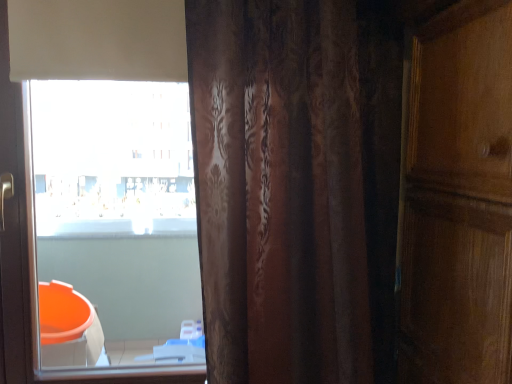
Question: Is white matte window at upper left not within brown textured curtain at center?

Choices:
 (A) yes
 (B) no

Answer: (A)

Question: From a real-world perspective, is white matte window at upper left over brown textured curtain at center?

Choices:
 (A) yes
 (B) no

Answer: (B)

Question: Is white matte window at upper left next to brown textured curtain at center?

Choices:
 (A) yes
 (B) no

Answer: (B)

Question: From the image's perspective, does white matte window at upper left appear lower than brown textured curtain at center?

Choices:
 (A) yes
 (B) no

Answer: (B)

Question: From a real-world perspective, is white matte window at upper left below brown textured curtain at center?

Choices:
 (A) yes
 (B) no

Answer: (A)

Question: Does white matte window at upper left have a smaller size compared to brown textured curtain at center?

Choices:
 (A) no
 (B) yes

Answer: (B)

Question: From a real-world perspective, is brown textured curtain at center positioned over white matte window at upper left based on gravity?

Choices:
 (A) no
 (B) yes

Answer: (B)

Question: Is brown textured curtain at center in front of white matte window at upper left?

Choices:
 (A) yes
 (B) no

Answer: (A)

Question: Can we say brown textured curtain at center lies outside white matte window at upper left?

Choices:
 (A) yes
 (B) no

Answer: (A)

Question: Considering the relative sizes of brown textured curtain at center and white matte window at upper left in the image provided, is brown textured curtain at center bigger than white matte window at upper left?

Choices:
 (A) no
 (B) yes

Answer: (B)

Question: Is there a large distance between brown textured curtain at center and white matte window at upper left?

Choices:
 (A) no
 (B) yes

Answer: (A)

Question: Can you confirm if brown textured curtain at center is shorter than white matte window at upper left?

Choices:
 (A) no
 (B) yes

Answer: (B)

Question: Is white matte window at upper left to the left or to the right of brown textured curtain at center in the image?

Choices:
 (A) right
 (B) left

Answer: (B)